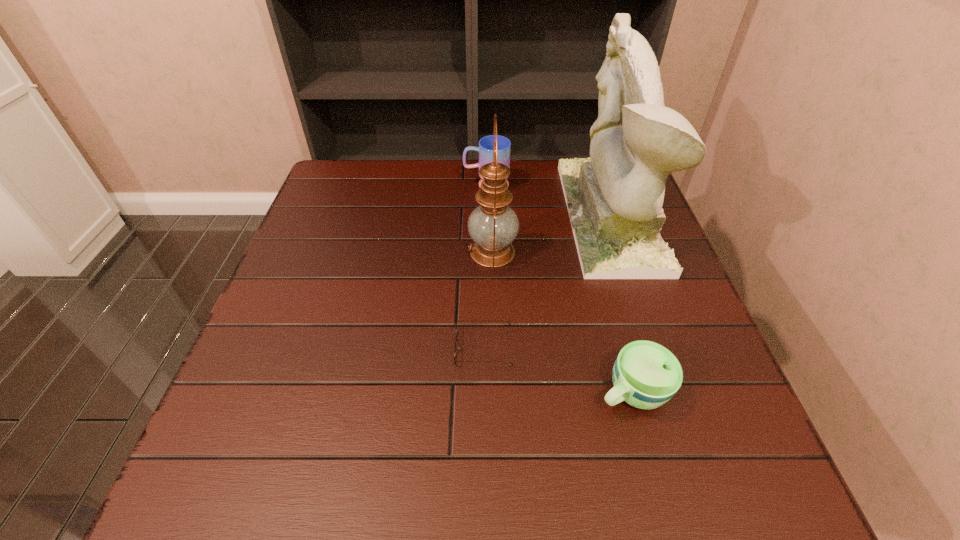
The height and width of the screenshot is (540, 960). I want to click on object present at the far right corner, so pyautogui.click(x=614, y=199).

Locate an element on the screen. This screenshot has height=540, width=960. free space at the far edge of the desktop is located at coordinates (395, 162).

In the image, there is a desktop. Identify the location of vacant area at the near edge. Image resolution: width=960 pixels, height=540 pixels. (416, 460).

Identify the location of vacant area at the left edge. The image size is (960, 540). (351, 217).

Locate an element on the screen. The width and height of the screenshot is (960, 540). vacant space at the right edge of the desktop is located at coordinates (660, 326).

You are a GUI agent. You are given a task and a screenshot of the screen. Output one action in this format:
    pyautogui.click(x=<x>, y=<y>)
    Task: Click on the blank area at the far left corner
    This screenshot has width=960, height=540.
    Given the screenshot: What is the action you would take?
    click(x=344, y=192)

In the image, there is a desktop. Identify the location of vacant space at the near right corner. This screenshot has height=540, width=960. (710, 471).

The image size is (960, 540). Find the location of `free space between the sunglasses and the second shortest object`. free space between the sunglasses and the second shortest object is located at coordinates (558, 369).

At what (x,y) coordinates should I click in order to perform the action: click on vacant space that's between the oil lamp and the shortest object. Please return your answer as a coordinate pair (x, y). The width and height of the screenshot is (960, 540). Looking at the image, I should click on (488, 300).

Find the location of `vacant area that lies between the third shortest object and the cup`. vacant area that lies between the third shortest object and the cup is located at coordinates (559, 288).